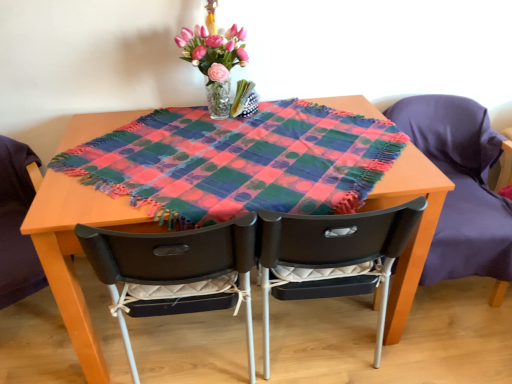
What do you see at coordinates (461, 188) in the screenshot? I see `matte black chair at right, which is the 3th chair in left-to-right order` at bounding box center [461, 188].

Image resolution: width=512 pixels, height=384 pixels. What do you see at coordinates (333, 255) in the screenshot?
I see `black plastic chair at center, the 2th chair positioned from the right` at bounding box center [333, 255].

Locate an element on the screen. This screenshot has width=512, height=384. translucent glass vase at upper center is located at coordinates (215, 63).

What are the coordinates of `matte black chair at center, the 1th chair viewed from the left` in the screenshot? It's located at (x=175, y=259).

This screenshot has width=512, height=384. Find the location of `matte black chair at right, which is the first chair from right to left`. matte black chair at right, which is the first chair from right to left is located at coordinates (461, 188).

Is matte black chair at center, the 1th chair viewed from the left, placed right next to translucent glass vase at upper center?

No.

Which object is closer to the camera taking this photo, matte black chair at center, the 1th chair viewed from the left, or translucent glass vase at upper center?

matte black chair at center, the 1th chair viewed from the left, is closer to the camera.

Does matte black chair at center, the 1th chair viewed from the left, appear on the left side of translucent glass vase at upper center?

Correct, you'll find matte black chair at center, the 1th chair viewed from the left, to the left of translucent glass vase at upper center.

Based on the photo, would you say matte black chair at right, which is the first chair from right to left, contains wooden table at center?

No, wooden table at center is located outside of matte black chair at right, which is the first chair from right to left.

Who is taller, matte black chair at right, which is the 3th chair in left-to-right order, or wooden table at center?

matte black chair at right, which is the 3th chair in left-to-right order, is taller.

From the image's perspective, between matte black chair at right, which is the 3th chair in left-to-right order, and wooden table at center, which one is located above?

From the image's view, wooden table at center is above.

Is point (481, 194) behind point (54, 237)?

Yes.

Does wooden table at center have a greater height compared to matte black chair at right, which is the 3th chair in left-to-right order?

No, wooden table at center is not taller than matte black chair at right, which is the 3th chair in left-to-right order.

In terms of width, does wooden table at center look wider or thinner when compared to matte black chair at right, which is the first chair from right to left?

Clearly, wooden table at center has more width compared to matte black chair at right, which is the first chair from right to left.

Are wooden table at center and matte black chair at right, which is the first chair from right to left, located far from each other?

Yes, wooden table at center and matte black chair at right, which is the first chair from right to left, are quite far apart.

Is wooden table at center smaller than matte black chair at right, which is the 3th chair in left-to-right order?

Yes.

Is black plastic chair at center, the 2th chair positioned from the right, beside matte black chair at right, which is the 3th chair in left-to-right order?

No, black plastic chair at center, the 2th chair positioned from the right, is not next to matte black chair at right, which is the 3th chair in left-to-right order.

From a real-world perspective, is black plastic chair at center, the 2th chair positioned from the right, under matte black chair at right, which is the first chair from right to left?

Yes, from a real-world perspective, black plastic chair at center, the 2th chair positioned from the right, is below matte black chair at right, which is the first chair from right to left.

Considering the positions of objects black plastic chair at center, the 2th chair positioned from the right, and matte black chair at right, which is the 3th chair in left-to-right order, in the image provided, who is behind, black plastic chair at center, the 2th chair positioned from the right, or matte black chair at right, which is the 3th chair in left-to-right order,?

matte black chair at right, which is the 3th chair in left-to-right order, is behind.

Would you say black plastic chair at center, the second chair viewed from the left, is outside matte black chair at right, which is the first chair from right to left?

Yes.

Locate an element on the screen. Image resolution: width=512 pixels, height=384 pixels. table on the left side of black plastic chair at center, the 2th chair positioned from the right is located at coordinates (77, 252).

Choose the correct answer: Is wooden table at center inside black plastic chair at center, the 2th chair positioned from the right, or outside it?

wooden table at center is outside black plastic chair at center, the 2th chair positioned from the right.

From the image's perspective, which one is positioned lower, wooden table at center or black plastic chair at center, the 2th chair positioned from the right?

black plastic chair at center, the 2th chair positioned from the right, from the image's perspective.

From a real-world perspective, is wooden table at center beneath black plastic chair at center, the second chair viewed from the left?

Incorrect, from a real-world perspective, wooden table at center is higher than black plastic chair at center, the second chair viewed from the left.

Is matte black chair at right, which is the first chair from right to left, positioned with its back to matte black chair at center, the third chair viewed from the right?

No, matte black chair at right, which is the first chair from right to left, is not facing away from matte black chair at center, the third chair viewed from the right.

Does point (503, 243) lie in front of point (240, 231)?

That is False.

In the image, is matte black chair at right, which is the first chair from right to left, positioned in front of or behind matte black chair at center, the third chair viewed from the right?

matte black chair at right, which is the first chair from right to left, is behind matte black chair at center, the third chair viewed from the right.

Is matte black chair at right, which is the 3th chair in left-to-right order, taller than matte black chair at center, the 1th chair viewed from the left?

In fact, matte black chair at right, which is the 3th chair in left-to-right order, may be shorter than matte black chair at center, the 1th chair viewed from the left.

Can wooden table at center be found inside translucent glass vase at upper center?

No.

How different are the orientations of translucent glass vase at upper center and wooden table at center in degrees?

42.8 degrees.

Is translucent glass vase at upper center looking in the opposite direction of wooden table at center?

That's not correct — translucent glass vase at upper center is not looking away from wooden table at center.

From a real-world perspective, is translucent glass vase at upper center physically above wooden table at center?

Indeed, from a real-world perspective, translucent glass vase at upper center stands above wooden table at center.

Find the location of a particular element. The width and height of the screenshot is (512, 384). chair to the left of translucent glass vase at upper center is located at coordinates (175, 259).

This screenshot has width=512, height=384. What are the coordinates of `table above the matte black chair at right, which is the 3th chair in left-to-right order (from a real-world perspective)` in the screenshot? It's located at (77, 252).

When comparing their distances from black plastic chair at center, the 2th chair positioned from the right, does translucent glass vase at upper center or wooden table at center seem closer?

wooden table at center.

When comparing their distances from matte black chair at right, which is the first chair from right to left, does black plastic chair at center, the 2th chair positioned from the right, or matte black chair at center, the third chair viewed from the right, seem further?

matte black chair at center, the third chair viewed from the right, lies further to matte black chair at right, which is the first chair from right to left, than the other object.

Estimate the real-world distances between objects in this image. Which object is closer to translucent glass vase at upper center, matte black chair at right, which is the 3th chair in left-to-right order, or black plastic chair at center, the 2th chair positioned from the right?

Among the two, black plastic chair at center, the 2th chair positioned from the right, is located nearer to translucent glass vase at upper center.

In the scene shown: Based on their spatial positions, is translucent glass vase at upper center or black plastic chair at center, the second chair viewed from the left, further from matte black chair at center, the 1th chair viewed from the left?

The object further to matte black chair at center, the 1th chair viewed from the left, is translucent glass vase at upper center.

Which object lies nearer to the anchor point translucent glass vase at upper center, matte black chair at center, the third chair viewed from the right, or wooden table at center?

wooden table at center lies closer to translucent glass vase at upper center than the other object.

From the image, which object appears to be nearer to black plastic chair at center, the 2th chair positioned from the right, wooden table at center or matte black chair at center, the 1th chair viewed from the left?

Based on the image, matte black chair at center, the 1th chair viewed from the left, appears to be nearer to black plastic chair at center, the 2th chair positioned from the right.

Estimate the real-world distances between objects in this image. Which object is closer to matte black chair at right, which is the 3th chair in left-to-right order, black plastic chair at center, the 2th chair positioned from the right, or translucent glass vase at upper center?

Among the two, black plastic chair at center, the 2th chair positioned from the right, is located nearer to matte black chair at right, which is the 3th chair in left-to-right order.

Looking at the image, which one is located closer to wooden table at center, black plastic chair at center, the second chair viewed from the left, or matte black chair at right, which is the first chair from right to left?

black plastic chair at center, the second chair viewed from the left, is closer to wooden table at center.

The image size is (512, 384). What are the coordinates of `chair between translucent glass vase at upper center and matte black chair at right, which is the first chair from right to left` in the screenshot? It's located at (333, 255).

I want to click on table between translucent glass vase at upper center and matte black chair at right, which is the 3th chair in left-to-right order, in the horizontal direction, so click(x=77, y=252).

Locate an element on the screen. chair between wooden table at center and matte black chair at right, which is the 3th chair in left-to-right order is located at coordinates (333, 255).

Where is `table between translucent glass vase at upper center and black plastic chair at center, the second chair viewed from the left, in the up-down direction`? table between translucent glass vase at upper center and black plastic chair at center, the second chair viewed from the left, in the up-down direction is located at coordinates (77, 252).